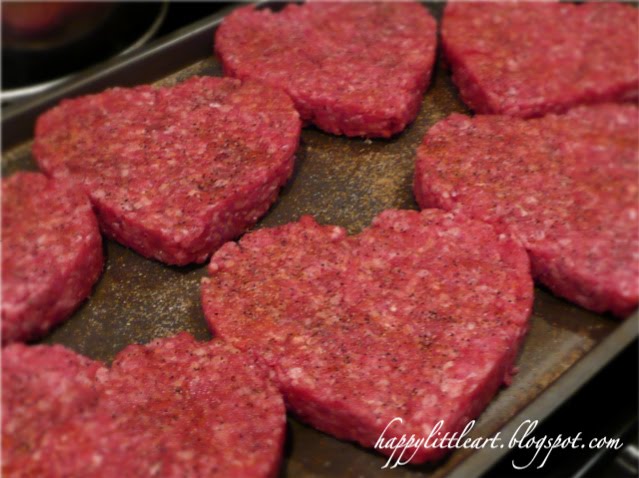
You are a GUI agent. You are given a task and a screenshot of the screen. Output one action in this format:
    pyautogui.click(x=<x>, y=<y>)
    Task: Click on the metal tray
    This screenshot has height=478, width=639.
    Given the screenshot: What is the action you would take?
    pyautogui.click(x=342, y=459), pyautogui.click(x=558, y=350), pyautogui.click(x=139, y=287), pyautogui.click(x=19, y=154), pyautogui.click(x=351, y=165), pyautogui.click(x=436, y=9), pyautogui.click(x=581, y=3), pyautogui.click(x=629, y=101), pyautogui.click(x=195, y=52), pyautogui.click(x=275, y=3)